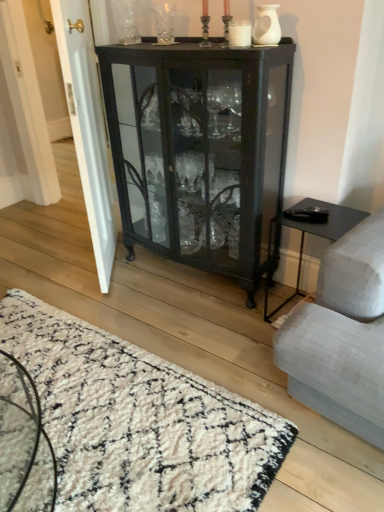
Question: Can you confirm if white glossy door at left is wider than white matte vase at upper center, the second glass vase in the left-to-right sequence?

Choices:
 (A) no
 (B) yes

Answer: (B)

Question: From the image's perspective, is white glossy door at left below white matte vase at upper center, the 1th glass vase when ordered from right to left?

Choices:
 (A) no
 (B) yes

Answer: (B)

Question: Is white glossy door at left oriented away from white matte vase at upper center, which is the first glass vase in bottom-to-top order?

Choices:
 (A) no
 (B) yes

Answer: (B)

Question: Is white glossy door at left outside white matte vase at upper center, the second glass vase in the left-to-right sequence?

Choices:
 (A) no
 (B) yes

Answer: (B)

Question: Is the position of white glossy door at left more distant than that of white matte vase at upper center, the second glass vase in the left-to-right sequence?

Choices:
 (A) no
 (B) yes

Answer: (B)

Question: In the image, is white matte vase at upper center, the 1th glass vase when ordered from right to left, positioned in front of or behind white shaggy rug at lower left?

Choices:
 (A) behind
 (B) front

Answer: (A)

Question: In terms of height, does white matte vase at upper center, which is the first glass vase in front-to-back order, look taller or shorter compared to white shaggy rug at lower left?

Choices:
 (A) tall
 (B) short

Answer: (A)

Question: Is point (259, 13) closer or farther from the camera than point (72, 400)?

Choices:
 (A) closer
 (B) farther

Answer: (A)

Question: From the image's perspective, is white matte vase at upper center, which is the first glass vase in front-to-back order, above or below white shaggy rug at lower left?

Choices:
 (A) above
 (B) below

Answer: (A)

Question: Looking at their shapes, would you say clear glass vase at upper center, the 1th glass vase in the top-to-bottom sequence, is wider or thinner than white shaggy rug at lower left?

Choices:
 (A) thin
 (B) wide

Answer: (A)

Question: From the image's perspective, is clear glass vase at upper center, which ranks as the 1th glass vase in left-to-right order, positioned above or below white shaggy rug at lower left?

Choices:
 (A) above
 (B) below

Answer: (A)

Question: Based on their sizes in the image, would you say clear glass vase at upper center, the 2th glass vase viewed from the right, is bigger or smaller than white shaggy rug at lower left?

Choices:
 (A) small
 (B) big

Answer: (A)

Question: In the image, is clear glass vase at upper center, arranged as the first glass vase when viewed from the back, positioned in front of or behind white shaggy rug at lower left?

Choices:
 (A) behind
 (B) front

Answer: (A)

Question: Would you say black glass cabinet at center is to the left or to the right of clear glass vase at upper center, the 2th glass vase viewed from the right, in the picture?

Choices:
 (A) left
 (B) right

Answer: (B)

Question: From the image's perspective, is black glass cabinet at center above or below clear glass vase at upper center, which ranks as the 1th glass vase in left-to-right order?

Choices:
 (A) above
 (B) below

Answer: (B)